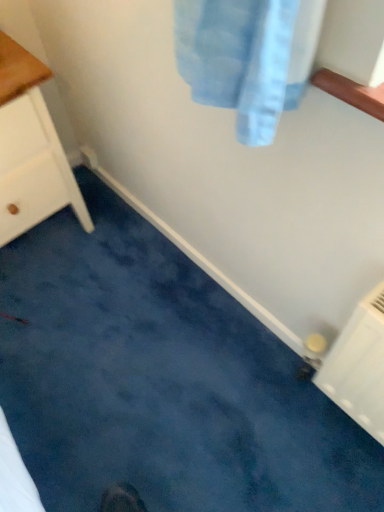
Locate an element on the screen. white wood chest of drawers at left is located at coordinates (30, 149).

The height and width of the screenshot is (512, 384). What do you see at coordinates (30, 149) in the screenshot?
I see `white wood chest of drawers at left` at bounding box center [30, 149].

Locate an element on the screen. The image size is (384, 512). white wood chest of drawers at left is located at coordinates (30, 149).